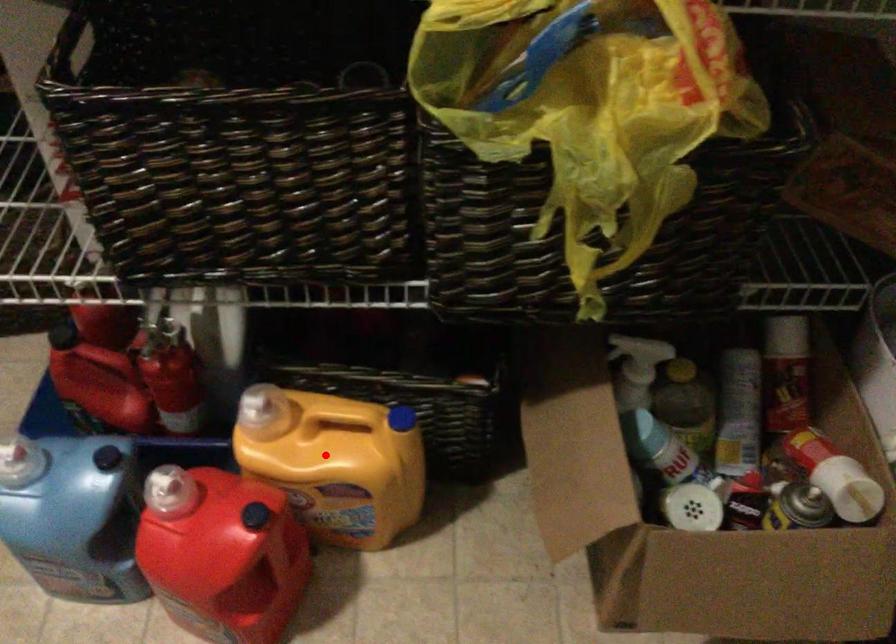
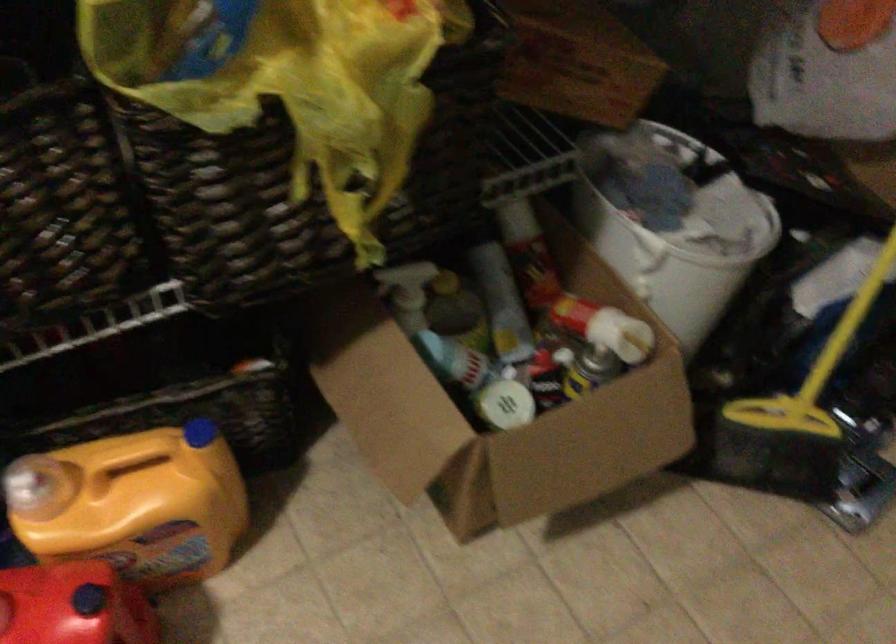
The point at the highlighted location is marked in the first image. Where is the corresponding point in the second image?

(133, 504)